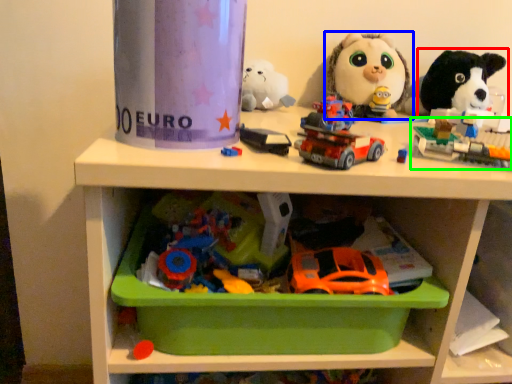
Question: Which object is the farthest from toy (highlighted by a red box)? Choose among these: toy (highlighted by a blue box) or toy (highlighted by a green box).

Choices:
 (A) toy
 (B) toy

Answer: (B)